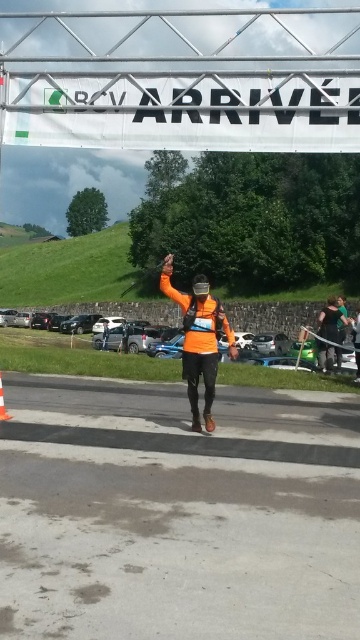
You are a race organizer who needs to ensure that the green fabric jacket at center and the orange plastic traffic cone at center are placed at least 20 feet apart for safety. Based on the image, are they currently positioned correctly?

The distance between the green fabric jacket at center and the orange plastic traffic cone at center is 19.40 feet, which is less than the required 20 feet. Therefore, they are not positioned correctly and need to be moved farther apart.

You are a photographer at the finish line and want to capture both the orange matte running suit at center and the green fabric jacket at center in the same frame. Which one should you focus on first to ensure both are in the shot?

The orange matte running suit at center is to the left of the green fabric jacket at center, so focusing on the orange matte running suit at center first will allow you to frame both objects since they are positioned side by side.